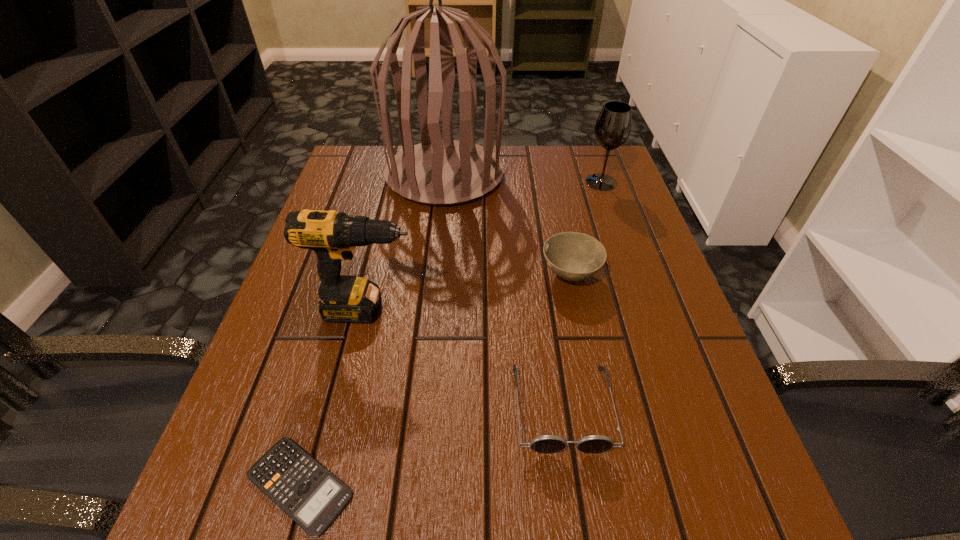
The width and height of the screenshot is (960, 540). I want to click on the tallest object, so click(x=437, y=172).

Where is `drill`? The image size is (960, 540). drill is located at coordinates (333, 236).

The height and width of the screenshot is (540, 960). What are the coordinates of `wineglass` in the screenshot? It's located at (613, 127).

Locate an element on the screen. This screenshot has width=960, height=540. the fourth tallest object is located at coordinates (573, 256).

You are a GUI agent. You are given a task and a screenshot of the screen. Output one action in this format:
    pyautogui.click(x=<x>, y=<y>)
    Task: Click on the sunglasses
    
    Given the screenshot: What is the action you would take?
    pyautogui.click(x=546, y=444)

Where is `calculator`? calculator is located at coordinates (306, 491).

The image size is (960, 540). In order to click on vacant area situated 0.070m on the front of the birdcage in this screenshot , I will do `click(439, 228)`.

At what (x,y) coordinates should I click in order to perform the action: click on free space located 0.290m at the tip of the drill. Please return your answer as a coordinate pair (x, y). Looking at the image, I should click on (570, 310).

The image size is (960, 540). In order to click on free space located on the left of the wineglass in this screenshot , I will do `click(516, 183)`.

Where is `free space located 0.080m on the left of the bowl`? The image size is (960, 540). free space located 0.080m on the left of the bowl is located at coordinates (502, 275).